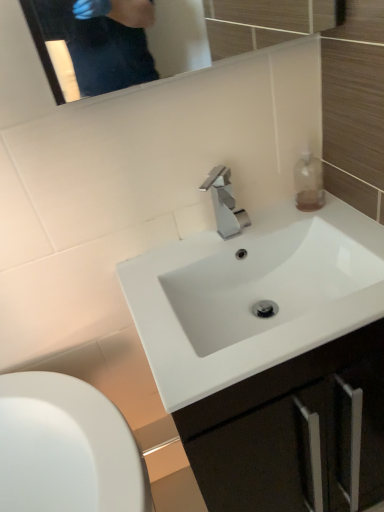
Image resolution: width=384 pixels, height=512 pixels. Describe the element at coordinates (267, 281) in the screenshot. I see `white glossy sink at center, the first sink positioned from the top` at that location.

The image size is (384, 512). What do you see at coordinates (225, 203) in the screenshot?
I see `polished metallic faucet at center` at bounding box center [225, 203].

Where is `polished metallic faucet at center`? This screenshot has width=384, height=512. polished metallic faucet at center is located at coordinates (225, 203).

What do you see at coordinates (253, 296) in the screenshot? The width and height of the screenshot is (384, 512). I see `white glossy sink at center, the first sink when ordered from bottom to top` at bounding box center [253, 296].

Identify the location of white glossy sink at center, the first sink positioned from the top. (267, 281).

Which of these two, translucent glass bottle at upper right or polished metallic faucet at center, is thinner?

translucent glass bottle at upper right.

Is translucent glass bottle at upper right positioned before polished metallic faucet at center?

No, the depth of translucent glass bottle at upper right is greater than that of polished metallic faucet at center.

Would you say translucent glass bottle at upper right contains polished metallic faucet at center?

No.

From the image's perspective, who appears lower, translucent glass bottle at upper right or polished metallic faucet at center?

polished metallic faucet at center appears lower in the image.

The image size is (384, 512). Find the location of `bottle located on the right of white glossy sink at center, the first sink when ordered from bottom to top`. bottle located on the right of white glossy sink at center, the first sink when ordered from bottom to top is located at coordinates (308, 181).

Could you tell me if translucent glass bottle at upper right is turned towards white glossy sink at center, the first sink when ordered from bottom to top?

No.

From the image's perspective, relative to white glossy sink at center, the second sink viewed from the top, is translucent glass bottle at upper right above or below?

translucent glass bottle at upper right is above white glossy sink at center, the second sink viewed from the top.

Can we say translucent glass bottle at upper right lies outside white glossy sink at center, the second sink viewed from the top?

Yes, translucent glass bottle at upper right is not within white glossy sink at center, the second sink viewed from the top.

Is white glossy sink at center, the first sink when ordered from bottom to top, at the right side of polished metallic faucet at center?

Yes.

Between white glossy sink at center, the second sink viewed from the top, and polished metallic faucet at center, which one has larger width?

Result: white glossy sink at center, the second sink viewed from the top.

From the image's perspective, does white glossy sink at center, the first sink when ordered from bottom to top, appear higher than polished metallic faucet at center?

No, from the image's perspective, white glossy sink at center, the first sink when ordered from bottom to top, is not on top of polished metallic faucet at center.

Based on the photo, considering the sizes of objects polished metallic faucet at center and white glossy sink at center, the first sink positioned from the top, in the image provided, who is bigger, polished metallic faucet at center or white glossy sink at center, the first sink positioned from the top,?

Bigger between the two is white glossy sink at center, the first sink positioned from the top.

From a real-world perspective, which object stands above the other?

polished metallic faucet at center, from a real-world perspective.

Between polished metallic faucet at center and white glossy sink at center, the first sink positioned from the top, which one has larger width?

Wider between the two is white glossy sink at center, the first sink positioned from the top.

Based on the photo, is white glossy sink at center, the second sink viewed from the top, not near translucent glass bottle at upper right?

No, there isn't a large distance between white glossy sink at center, the second sink viewed from the top, and translucent glass bottle at upper right.

Is white glossy sink at center, the second sink viewed from the top, oriented away from translucent glass bottle at upper right?

white glossy sink at center, the second sink viewed from the top, is not turned away from translucent glass bottle at upper right.

Which of these two, white glossy sink at center, the second sink viewed from the top, or translucent glass bottle at upper right, is smaller?

With smaller size is translucent glass bottle at upper right.

Based on the photo, does white glossy sink at center, the first sink when ordered from bottom to top, appear on the right side of translucent glass bottle at upper right?

No, white glossy sink at center, the first sink when ordered from bottom to top, is not to the right of translucent glass bottle at upper right.

Is translucent glass bottle at upper right to the left of white glossy sink at center, which ranks as the 2th sink in bottom-to-top order, from the viewer's perspective?

In fact, translucent glass bottle at upper right is to the right of white glossy sink at center, which ranks as the 2th sink in bottom-to-top order.

Would you say translucent glass bottle at upper right is inside or outside white glossy sink at center, which ranks as the 2th sink in bottom-to-top order?

translucent glass bottle at upper right is not enclosed by white glossy sink at center, which ranks as the 2th sink in bottom-to-top order.

Is translucent glass bottle at upper right in front of or behind white glossy sink at center, which ranks as the 2th sink in bottom-to-top order, in the image?

Clearly, translucent glass bottle at upper right is behind white glossy sink at center, which ranks as the 2th sink in bottom-to-top order.

Is translucent glass bottle at upper right thinner than white glossy sink at center, which ranks as the 2th sink in bottom-to-top order?

Yes.

The image size is (384, 512). Identify the location of tap in front of the translucent glass bottle at upper right. (225, 203).

Is polished metallic faucet at center turned away from translucent glass bottle at upper right?

polished metallic faucet at center does not have its back to translucent glass bottle at upper right.

From a real-world perspective, who is located higher, polished metallic faucet at center or translucent glass bottle at upper right?

polished metallic faucet at center is physically above.

How distant is polished metallic faucet at center from translucent glass bottle at upper right?

The distance of polished metallic faucet at center from translucent glass bottle at upper right is 20.56 centimeters.

Locate an element on the screen. The height and width of the screenshot is (512, 384). tap below the translucent glass bottle at upper right (from the image's perspective) is located at coordinates (225, 203).

Identify the location of bottle located above the white glossy sink at center, the second sink viewed from the top (from the image's perspective). The image size is (384, 512). (308, 181).

When comparing their distances from white glossy sink at center, the first sink positioned from the top, does translucent glass bottle at upper right or polished metallic faucet at center seem further?

translucent glass bottle at upper right is further to white glossy sink at center, the first sink positioned from the top.

Considering their positions, is white glossy sink at center, the first sink when ordered from bottom to top, positioned closer to polished metallic faucet at center than white glossy sink at center, which ranks as the 2th sink in bottom-to-top order?

white glossy sink at center, which ranks as the 2th sink in bottom-to-top order, is positioned closer to the anchor polished metallic faucet at center.

When comparing their distances from white glossy sink at center, the second sink viewed from the top, does polished metallic faucet at center or white glossy sink at center, which ranks as the 2th sink in bottom-to-top order, seem closer?

The object closer to white glossy sink at center, the second sink viewed from the top, is white glossy sink at center, which ranks as the 2th sink in bottom-to-top order.

Estimate the real-world distances between objects in this image. Which object is further from translucent glass bottle at upper right, polished metallic faucet at center or white glossy sink at center, the first sink when ordered from bottom to top?

white glossy sink at center, the first sink when ordered from bottom to top, is further to translucent glass bottle at upper right.

Based on their spatial positions, is white glossy sink at center, the first sink when ordered from bottom to top, or white glossy sink at center, which ranks as the 2th sink in bottom-to-top order, further from translucent glass bottle at upper right?

white glossy sink at center, the first sink when ordered from bottom to top, is positioned further to the anchor translucent glass bottle at upper right.

From the image, which object appears to be farther from polished metallic faucet at center, translucent glass bottle at upper right or white glossy sink at center, the second sink viewed from the top?

The object further to polished metallic faucet at center is white glossy sink at center, the second sink viewed from the top.

Which object lies further to the anchor point translucent glass bottle at upper right, white glossy sink at center, the first sink positioned from the top, or polished metallic faucet at center?

white glossy sink at center, the first sink positioned from the top, lies further to translucent glass bottle at upper right than the other object.

Based on the photo, based on their spatial positions, is white glossy sink at center, which ranks as the 2th sink in bottom-to-top order, or translucent glass bottle at upper right closer to polished metallic faucet at center?

Among the two, white glossy sink at center, which ranks as the 2th sink in bottom-to-top order, is located nearer to polished metallic faucet at center.

Locate an element on the screen. The height and width of the screenshot is (512, 384). tap between translucent glass bottle at upper right and white glossy sink at center, the second sink viewed from the top, in the up-down direction is located at coordinates (225, 203).

In order to click on tap between translucent glass bottle at upper right and white glossy sink at center, which ranks as the 2th sink in bottom-to-top order, from top to bottom in this screenshot , I will do `click(225, 203)`.

I want to click on sink between polished metallic faucet at center and white glossy sink at center, the second sink viewed from the top, from top to bottom, so click(x=267, y=281).

Locate an element on the screen. The image size is (384, 512). sink between translucent glass bottle at upper right and white glossy sink at center, the second sink viewed from the top, in the up-down direction is located at coordinates (267, 281).